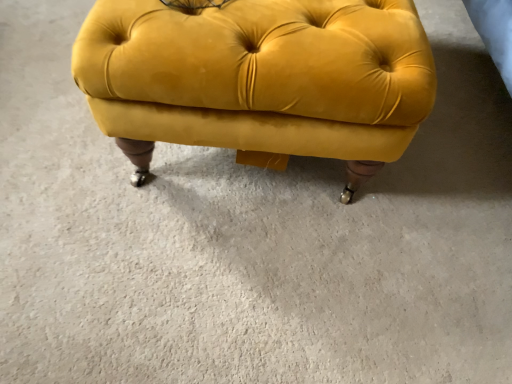
Image resolution: width=512 pixels, height=384 pixels. What do you see at coordinates (259, 78) in the screenshot? I see `velvet yellow ottoman at center` at bounding box center [259, 78].

Find the location of a particular element. Image resolution: width=512 pixels, height=384 pixels. velvet yellow ottoman at center is located at coordinates (259, 78).

You are a GUI agent. You are given a task and a screenshot of the screen. Output one action in this format:
    pyautogui.click(x=<x>, y=<y>)
    Task: Click on the velvet yellow ottoman at center
    The width and height of the screenshot is (512, 384).
    Given the screenshot: What is the action you would take?
    pyautogui.click(x=259, y=78)